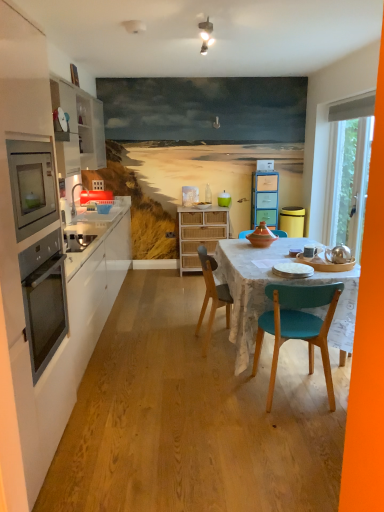
Question: From a real-world perspective, is transparent glass door at right beneath white plastic microwave at upper center?

Choices:
 (A) no
 (B) yes

Answer: (B)

Question: Does transparent glass door at right come in front of white plastic microwave at upper center?

Choices:
 (A) yes
 (B) no

Answer: (A)

Question: Is transparent glass door at right further to the viewer compared to white plastic microwave at upper center?

Choices:
 (A) yes
 (B) no

Answer: (B)

Question: From a real-world perspective, is transparent glass door at right physically above white plastic microwave at upper center?

Choices:
 (A) no
 (B) yes

Answer: (A)

Question: Is transparent glass door at right in contact with white plastic microwave at upper center?

Choices:
 (A) yes
 (B) no

Answer: (B)

Question: Does transparent glass door at right have a greater height compared to white plastic microwave at upper center?

Choices:
 (A) yes
 (B) no

Answer: (A)

Question: Is stainless steel oven at left to the left of translucent glass bottle at center from the viewer's perspective?

Choices:
 (A) no
 (B) yes

Answer: (B)

Question: Is stainless steel oven at left bigger than translucent glass bottle at center?

Choices:
 (A) no
 (B) yes

Answer: (B)

Question: Considering the relative sizes of stainless steel oven at left and translucent glass bottle at center in the image provided, is stainless steel oven at left shorter than translucent glass bottle at center?

Choices:
 (A) no
 (B) yes

Answer: (A)

Question: Are stainless steel oven at left and translucent glass bottle at center beside each other?

Choices:
 (A) no
 (B) yes

Answer: (A)

Question: From a real-world perspective, does stainless steel oven at left stand above translucent glass bottle at center?

Choices:
 (A) yes
 (B) no

Answer: (B)

Question: Considering the relative sizes of stainless steel oven at left and translucent glass bottle at center in the image provided, is stainless steel oven at left thinner than translucent glass bottle at center?

Choices:
 (A) no
 (B) yes

Answer: (A)

Question: From a real-world perspective, is white fabric exhaust hood at upper right positioned over white matte plate at center, the 2th plate when ordered from back to front, based on gravity?

Choices:
 (A) no
 (B) yes

Answer: (B)